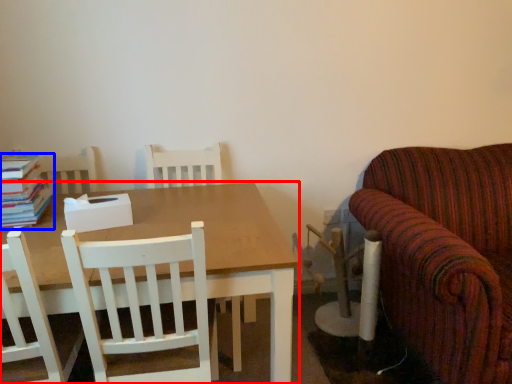
Question: Which object is further to the camera taking this photo, table (highlighted by a red box) or book (highlighted by a blue box)?

Choices:
 (A) table
 (B) book

Answer: (B)